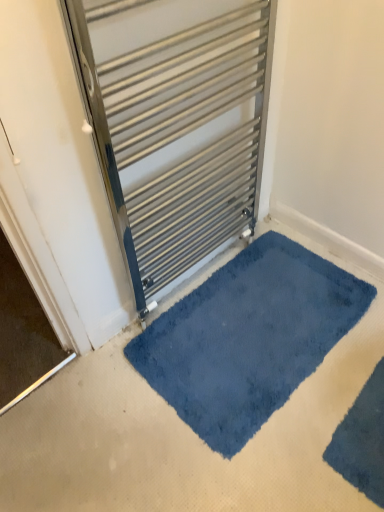
Question: Based on their positions, is blue plush bath mat at center, which ranks as the second bath mat in front-to-back order, located to the left or right of metallic silver radiator at center?

Choices:
 (A) right
 (B) left

Answer: (A)

Question: Is blue plush bath mat at center, which ranks as the second bath mat in front-to-back order, in front of or behind metallic silver radiator at center in the image?

Choices:
 (A) behind
 (B) front

Answer: (A)

Question: Considering the real-world distances, which object is farthest from the metallic silver radiator at center?

Choices:
 (A) blue plush bath mat at center, which ranks as the second bath mat in front-to-back order
 (B) velvety blue bath mat at lower right, positioned as the 2th bath mat in back-to-front order

Answer: (B)

Question: Considering the real-world distances, which object is closest to the velvety blue bath mat at lower right, which is the 1th bath mat from front to back?

Choices:
 (A) blue plush bath mat at center, which appears as the 1th bath mat when viewed from the back
 (B) metallic silver radiator at center

Answer: (A)